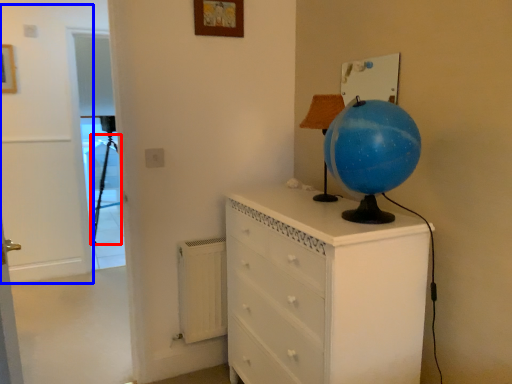
Question: Which of the following is the farthest to the observer, tripod (highlighted by a red box) or door (highlighted by a blue box)?

Choices:
 (A) tripod
 (B) door

Answer: (A)